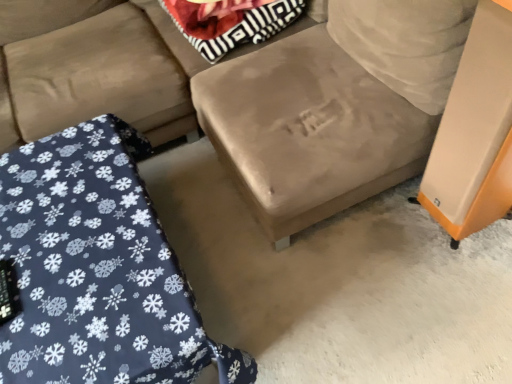
Question: Does suede-like beige couch at center have a greater width compared to velvet blue blanket at lower left?

Choices:
 (A) yes
 (B) no

Answer: (A)

Question: From the image's perspective, is suede-like beige couch at center beneath velvet blue blanket at lower left?

Choices:
 (A) no
 (B) yes

Answer: (A)

Question: Is suede-like beige couch at center facing towards velvet blue blanket at lower left?

Choices:
 (A) no
 (B) yes

Answer: (B)

Question: From a real-world perspective, is suede-like beige couch at center over velvet blue blanket at lower left?

Choices:
 (A) no
 (B) yes

Answer: (B)

Question: Can velvet blue blanket at lower left be found inside suede-like beige couch at center?

Choices:
 (A) yes
 (B) no

Answer: (B)

Question: Would you say suede-like beige couch at center is a long distance from velvet blue blanket at lower left?

Choices:
 (A) no
 (B) yes

Answer: (A)

Question: Does suede-like beige couch at center come behind striped fabric pillow at upper center?

Choices:
 (A) no
 (B) yes

Answer: (A)

Question: Is suede-like beige couch at center positioned in front of striped fabric pillow at upper center?

Choices:
 (A) yes
 (B) no

Answer: (A)

Question: Is suede-like beige couch at center smaller than striped fabric pillow at upper center?

Choices:
 (A) no
 (B) yes

Answer: (A)

Question: Is suede-like beige couch at center turned away from striped fabric pillow at upper center?

Choices:
 (A) no
 (B) yes

Answer: (B)

Question: Considering the relative positions of suede-like beige couch at center and striped fabric pillow at upper center in the image provided, is suede-like beige couch at center to the left of striped fabric pillow at upper center from the viewer's perspective?

Choices:
 (A) yes
 (B) no

Answer: (B)

Question: Does suede-like beige couch at center have a larger size compared to striped fabric pillow at upper center?

Choices:
 (A) yes
 (B) no

Answer: (A)

Question: Is orange matte speaker at right thinner than striped fabric pillow at upper center?

Choices:
 (A) no
 (B) yes

Answer: (B)